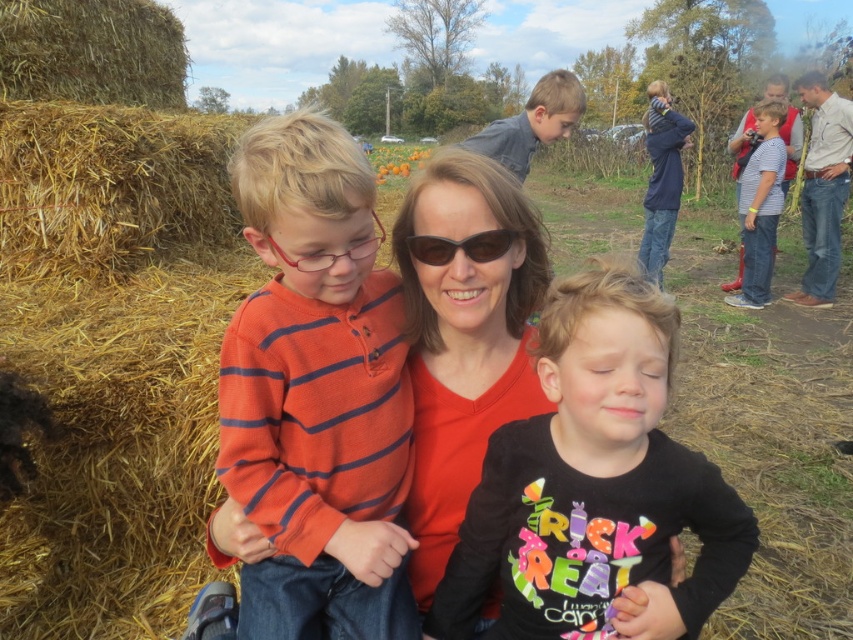
You are standing at the entrance of the pumpkin patch and see the matte orange sweater at center. Can you determine if the sweater is closer to the front or the back of the scene based on its position?

The matte orange sweater at center is located at point (463, 333), which places it near the center of the scene. Since the sweater is centrally positioned, it is neither closer to the front nor the back but situated in the middle of the scene.

You are trying to decide which item to grab first from the scene. The blue denim jacket at upper center and the sunglasses at center are both in your line of sight. Which one appears bigger?

The blue denim jacket at upper center has a larger size compared to sunglasses at center, so it appears bigger.